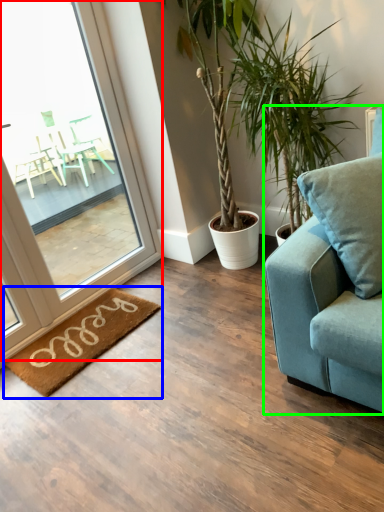
Question: Which object is positioned farthest from window (highlighted by a red box)? Select from mat (highlighted by a blue box) and studio couch (highlighted by a green box).

Choices:
 (A) mat
 (B) studio couch

Answer: (B)